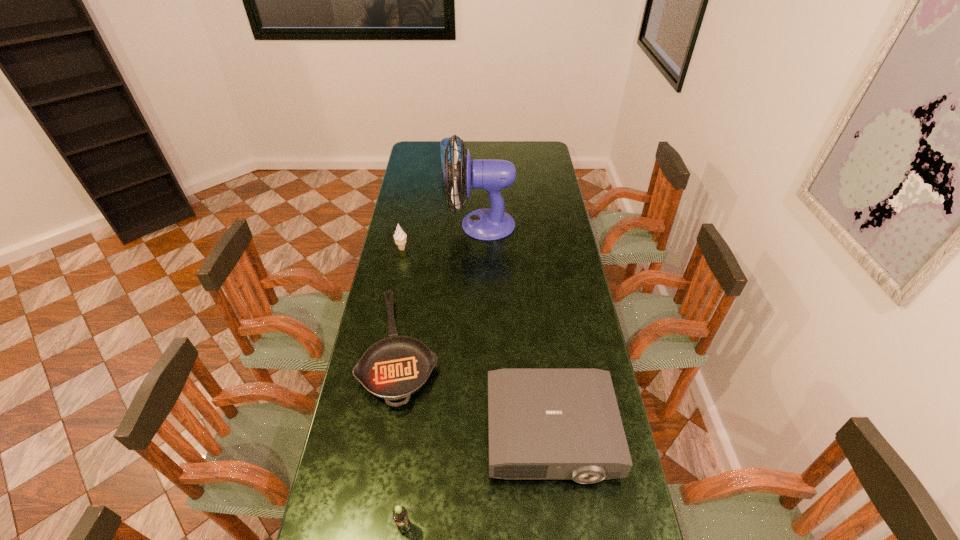
Identify the location of free point located 0.060m on the side of the second tallest object with the handle. (454, 154).

This screenshot has width=960, height=540. In order to click on blank space located on the side of the second tallest object with the handle in this screenshot , I will do `click(455, 145)`.

Find the location of a particular element. The height and width of the screenshot is (540, 960). blank space located 0.100m on the side of the second tallest object with the handle is located at coordinates (454, 151).

The image size is (960, 540). I want to click on vacant point located 0.170m on the front-facing side of the icecream, so click(448, 248).

This screenshot has height=540, width=960. Find the location of `vacant space located 0.110m on the front-facing side of the projector`. vacant space located 0.110m on the front-facing side of the projector is located at coordinates (563, 531).

What are the coordinates of `vacant space located 0.240m on the back of the shortest object` in the screenshot? It's located at (416, 256).

Locate an element on the screen. This screenshot has width=960, height=540. object at the far edge is located at coordinates (443, 143).

In order to click on icecream at the left edge in this screenshot , I will do `click(400, 236)`.

Identify the location of frying pan positioned at the left edge. (394, 368).

Locate an element on the screen. Image resolution: width=960 pixels, height=540 pixels. object that is at the right edge is located at coordinates (542, 423).